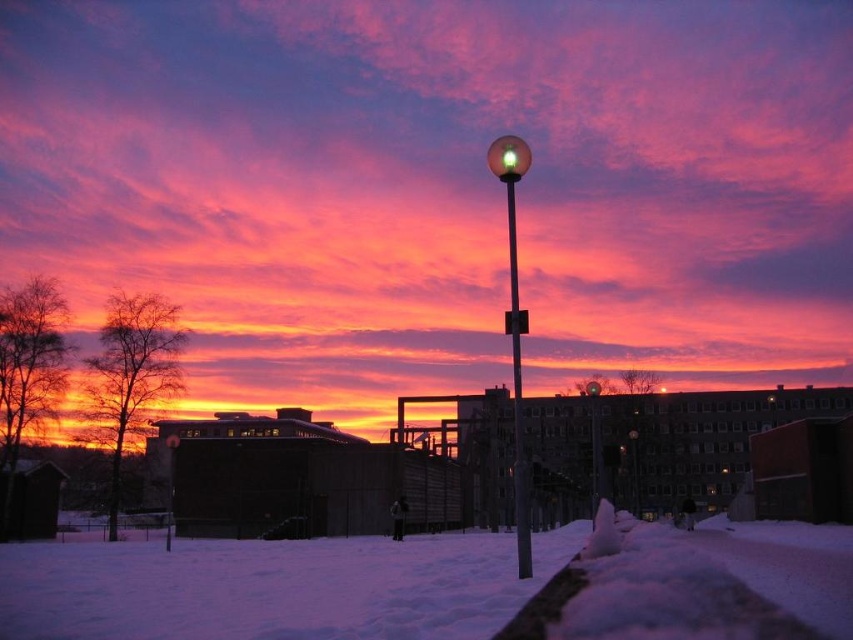
You are standing on the snow and looking up at the lamppost. Which object is closer to your eyes, the white fluffy snow at lower center or the glossy glass sphere at center?

The white fluffy snow at lower center is closer to your eyes because it is located above the glossy glass sphere at center, meaning the sphere is further away from you.

You are standing on the snow and want to walk towards the matte glass street light at center. Which direction should you move relative to the white fluffy snow at lower center?

You should move to the right relative to the white fluffy snow at lower center because the matte glass street light at center is to the right of the white fluffy snow at lower center.